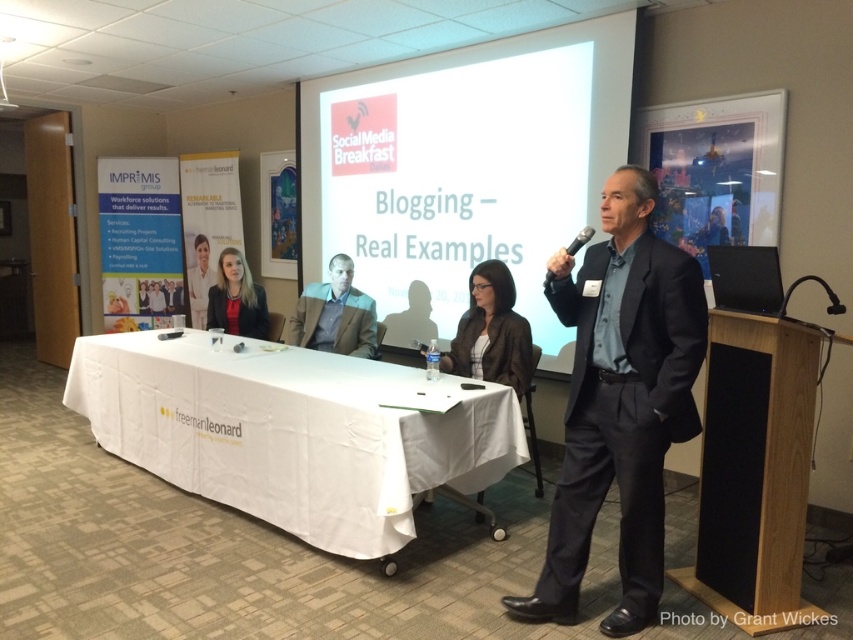
Question: Which object appears farthest from the camera in this image?

Choices:
 (A) matte white shirt at center
 (B) matte black jacket at center

Answer: (A)

Question: Estimate the real-world distances between objects in this image. Which object is farther from the white matte projection screen at center?

Choices:
 (A) matte black jacket at center
 (B) white cloth-covered table at center
 (C) brown leather jacket at center
 (D) matte black suit at center

Answer: (D)

Question: Is matte black blazer at center positioned at the back of matte black jacket at center?

Choices:
 (A) no
 (B) yes

Answer: (A)

Question: Among these objects, which one is nearest to the camera?

Choices:
 (A) matte black blazer at center
 (B) matte black suit at center
 (C) matte black jacket at center
 (D) dark blue suit at right

Answer: (D)

Question: Can you confirm if dark blue suit at right is thinner than matte black blazer at center?

Choices:
 (A) no
 (B) yes

Answer: (A)

Question: In this image, where is matte black blazer at center located relative to matte black suit at center?

Choices:
 (A) below
 (B) above

Answer: (A)